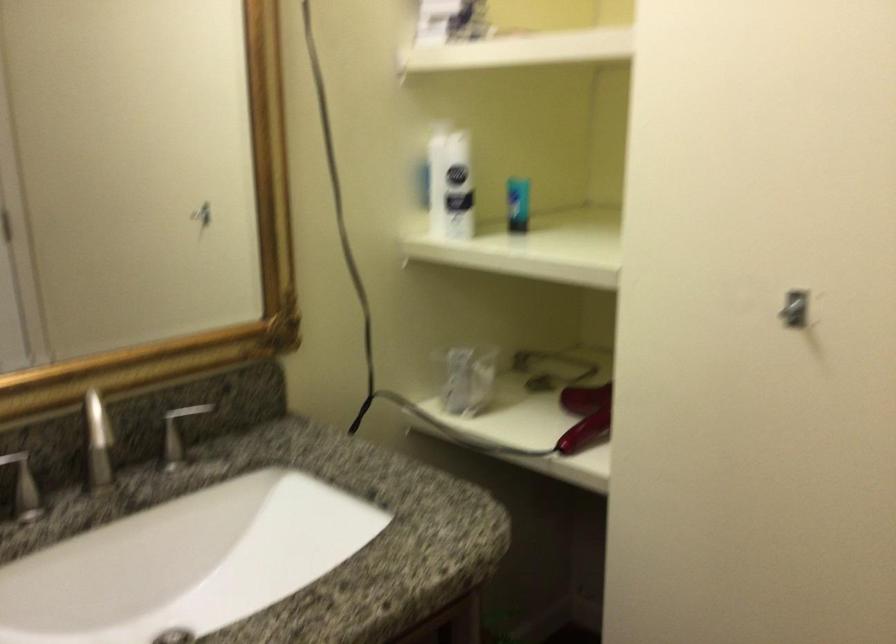
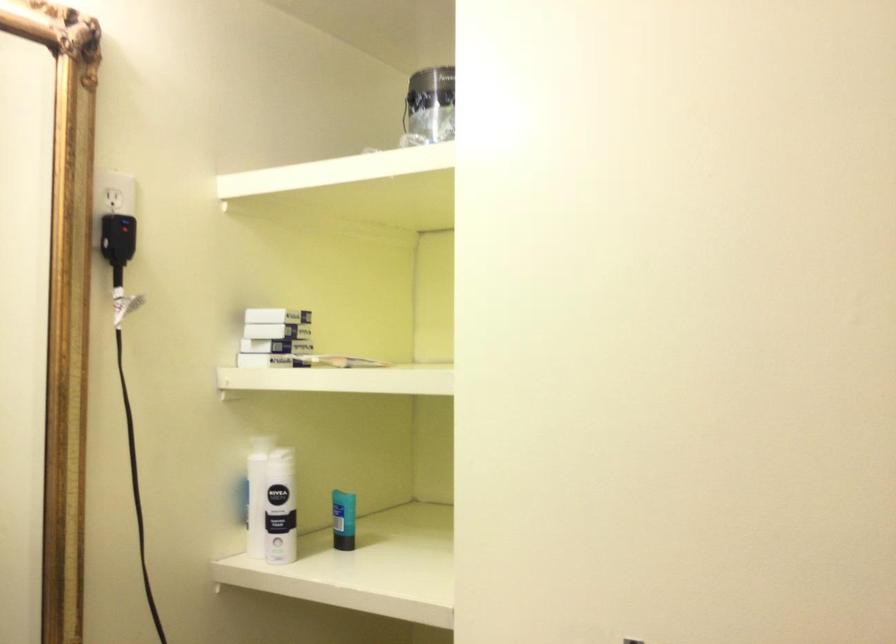
Locate, in the second image, the point that corresponds to [524,203] in the first image.

(343, 520)